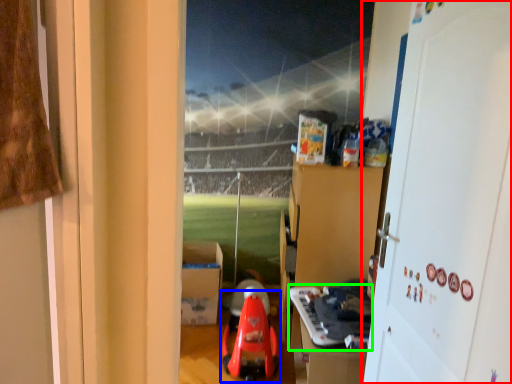
Question: Considering the real-world distances, which object is closest to door (highlighted by a red box)? toy (highlighted by a blue box) or toy (highlighted by a green box).

Choices:
 (A) toy
 (B) toy

Answer: (B)